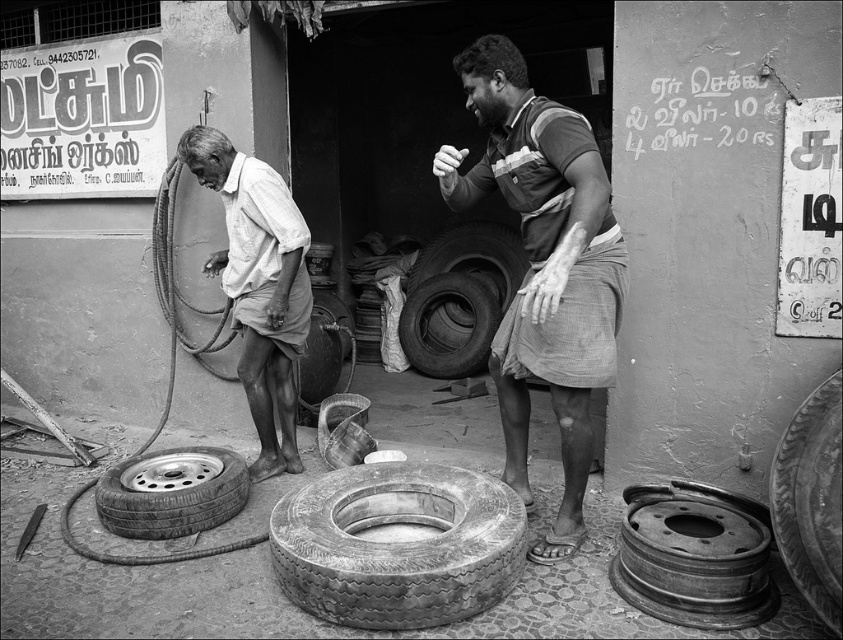
Which of these two, rubber/tire at center or rubber tire at center, stands taller?

With more height is rubber/tire at center.

Is rubber/tire at center wider than rubber tire at center?

No.

You are a GUI agent. You are given a task and a screenshot of the screen. Output one action in this format:
    pyautogui.click(x=<x>, y=<y>)
    Task: Click on the rubber/tire at center
    
    Given the screenshot: What is the action you would take?
    pyautogui.click(x=448, y=324)

Can you confirm if worn rubber tire at center is bigger than rubber/tire at center?

No, worn rubber tire at center is not bigger than rubber/tire at center.

Can you confirm if worn rubber tire at center is positioned above rubber/tire at center?

No.

Image resolution: width=843 pixels, height=640 pixels. Find the location of `worn rubber tire at center`. worn rubber tire at center is located at coordinates (396, 545).

Who is shorter, matte white shirt at center or rubber/tire at center?

rubber/tire at center

Does point (270, 294) come closer to viewer compared to point (439, 291)?

Yes, point (270, 294) is in front of point (439, 291).

Is point (266, 284) positioned in front of point (481, 317)?

Yes.

Where is `matte white shirt at center`? Image resolution: width=843 pixels, height=640 pixels. matte white shirt at center is located at coordinates (258, 284).